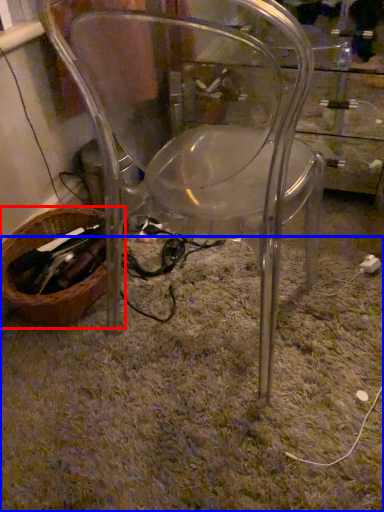
Question: Which of the following is the closest to the observer, basket (highlighted by a red box) or grass (highlighted by a blue box)?

Choices:
 (A) basket
 (B) grass

Answer: (B)